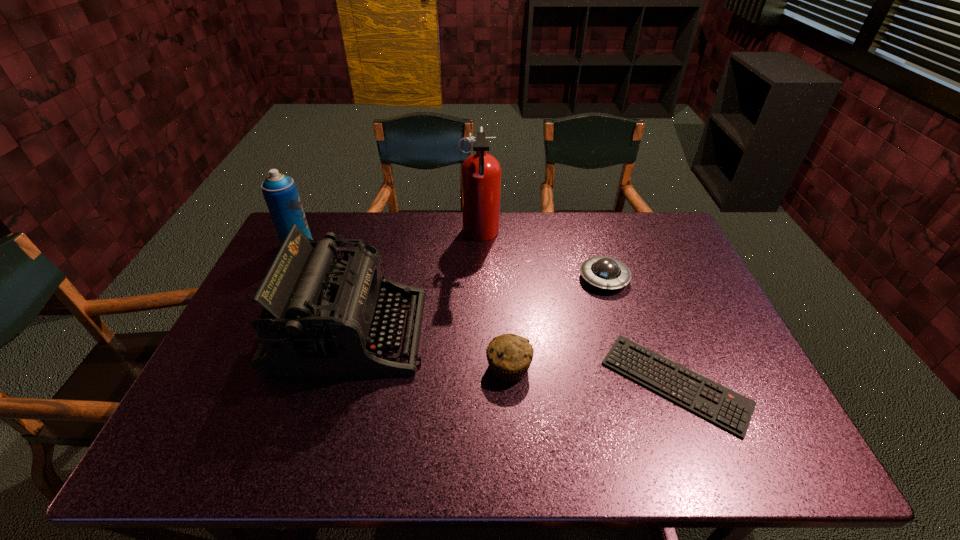
Where is `vacant area between the tallest object and the saucer`? vacant area between the tallest object and the saucer is located at coordinates (542, 256).

You are a GUI agent. You are given a task and a screenshot of the screen. Output one action in this format:
    pyautogui.click(x=<x>, y=<y>)
    Task: Click on the vacant region between the saucer and the tallest object
    Image resolution: width=960 pixels, height=540 pixels.
    Given the screenshot: What is the action you would take?
    pyautogui.click(x=542, y=256)

In order to click on unoccupied area between the second shortest object and the shortest object in this screenshot , I will do `click(639, 331)`.

This screenshot has height=540, width=960. I want to click on free space that is in between the shortest object and the tallest object, so click(x=578, y=309).

Locate which object ranks third in proximity to the aerosol can. Please provide its 2D coordinates. Your answer should be formatted as a tuple, i.e. [(x, y)], where the tuple contains the x and y coordinates of a point satisfying the conditions above.

[(509, 356)]

Identify the location of the closest object to the muffin. The width and height of the screenshot is (960, 540). (321, 315).

Locate an element on the screen. The width and height of the screenshot is (960, 540). free space that satisfies the following two spatial constraints: 1. on the front side of the saucer; 2. on the left side of the tallest object is located at coordinates [x=480, y=278].

Where is `free space that satisfies the following two spatial constraints: 1. on the front side of the tallest object; 2. on the left side of the fifth tallest object`? This screenshot has width=960, height=540. free space that satisfies the following two spatial constraints: 1. on the front side of the tallest object; 2. on the left side of the fifth tallest object is located at coordinates (480, 278).

Where is `vacant space that satisfies the following two spatial constraints: 1. on the keyboard of the typewriter; 2. on the right side of the computer keyboard`? The width and height of the screenshot is (960, 540). vacant space that satisfies the following two spatial constraints: 1. on the keyboard of the typewriter; 2. on the right side of the computer keyboard is located at coordinates [x=336, y=383].

The width and height of the screenshot is (960, 540). Identify the location of vacant position in the image that satisfies the following two spatial constraints: 1. on the front side of the third shortest object; 2. on the right side of the fire extinguisher. (480, 367).